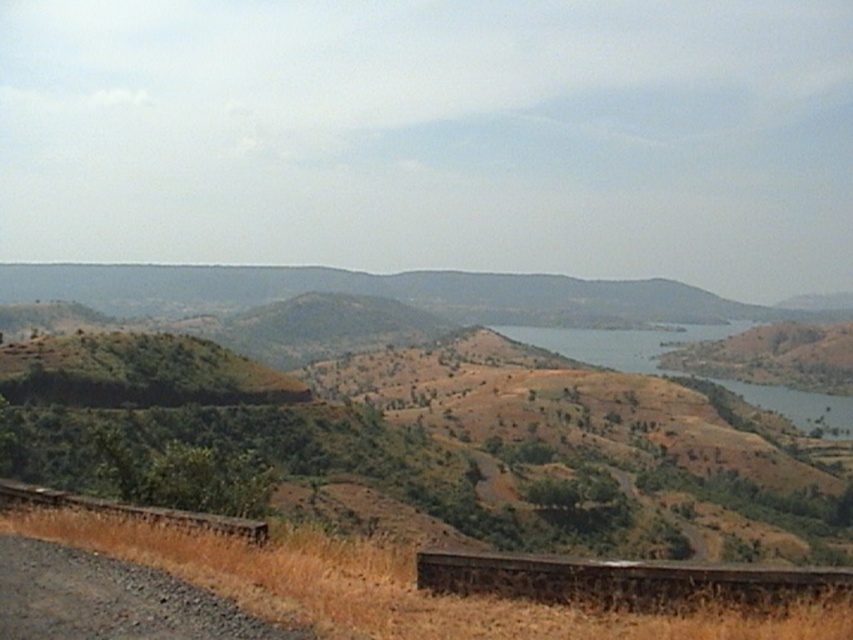
Question: From the image, what is the correct spatial relationship of brown concrete train track at lower center in relation to brown dirt at lower center?

Choices:
 (A) left
 (B) right

Answer: (A)

Question: Based on their relative distances, which object is nearer to the brown gravel dirt track at lower left?

Choices:
 (A) brown dirt at lower center
 (B) brown wooden train track at lower left
 (C) brown concrete train track at lower center

Answer: (B)

Question: Which point is closer to the camera taking this photo?

Choices:
 (A) (106, 627)
 (B) (785, 410)
 (C) (67, 499)

Answer: (A)

Question: Is brown concrete train track at lower center wider than brown wooden train track at lower left?

Choices:
 (A) yes
 (B) no

Answer: (B)

Question: Considering the relative positions of brown gravel dirt track at lower left and brown dirt at lower center in the image provided, where is brown gravel dirt track at lower left located with respect to brown dirt at lower center?

Choices:
 (A) above
 (B) below

Answer: (A)

Question: Among these objects, which one is nearest to the camera?

Choices:
 (A) brown concrete train track at lower center
 (B) brown wooden train track at lower left
 (C) brown gravel dirt track at lower left

Answer: (C)